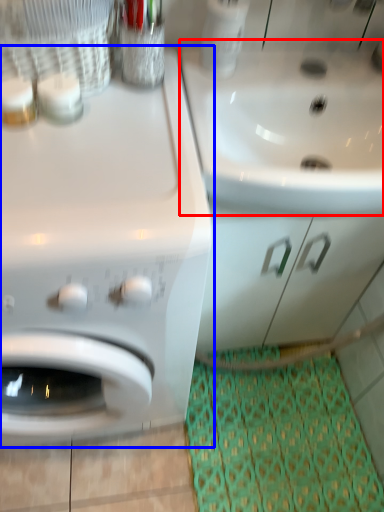
Question: Which object appears closest to the camera in this image, sink (highlighted by a red box) or washing machine (highlighted by a blue box)?

Choices:
 (A) sink
 (B) washing machine

Answer: (B)